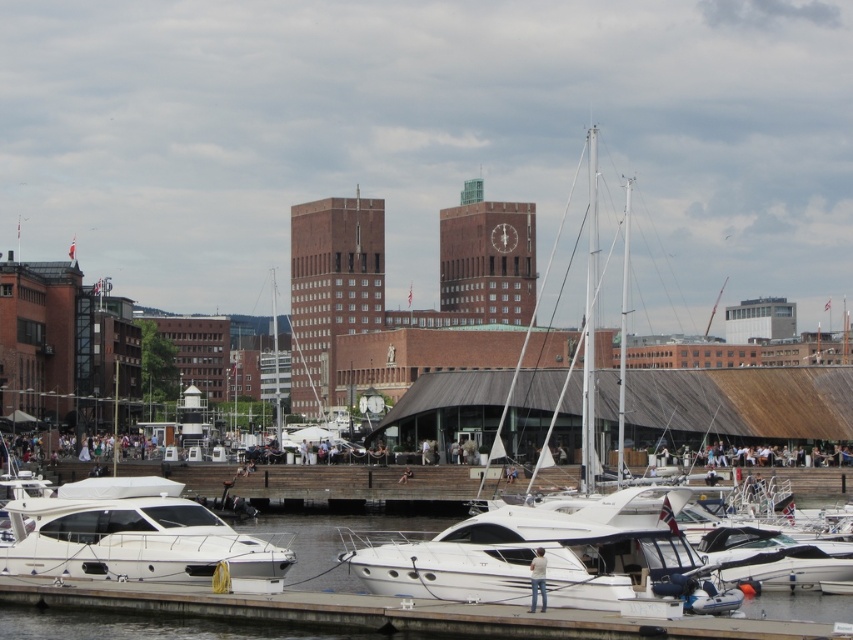
Question: Does white glossy boat at center appear under white glossy motorboat at lower left?

Choices:
 (A) no
 (B) yes

Answer: (B)

Question: Which point is closer to the camera?

Choices:
 (A) white glossy motorboat at lower left
 (B) white glossy water at center
 (C) white glossy boat at center

Answer: (C)

Question: Which point is farther to the camera?

Choices:
 (A) (676, 524)
 (B) (57, 557)

Answer: (A)

Question: Can you confirm if white glossy motorboat at lower left is positioned above white glossy water at center?

Choices:
 (A) yes
 (B) no

Answer: (A)

Question: Which object is positioned farthest from the white glossy motorboat at lower left?

Choices:
 (A) white glossy water at center
 (B) white glossy boat at center

Answer: (A)

Question: Can you confirm if white glossy boat at center is thinner than white glossy motorboat at lower left?

Choices:
 (A) no
 (B) yes

Answer: (A)